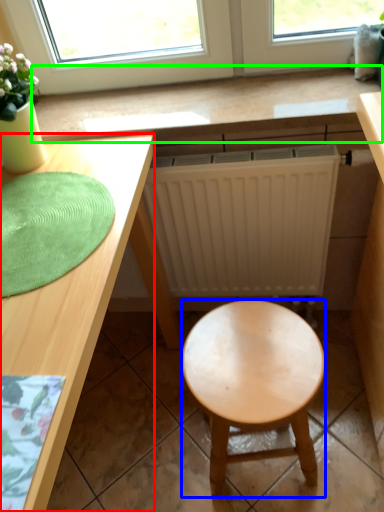
Question: Estimate the real-world distances between objects in this image. Which object is farther from desk (highlighted by a red box), stool (highlighted by a blue box) or counter top (highlighted by a green box)?

Choices:
 (A) stool
 (B) counter top

Answer: (A)